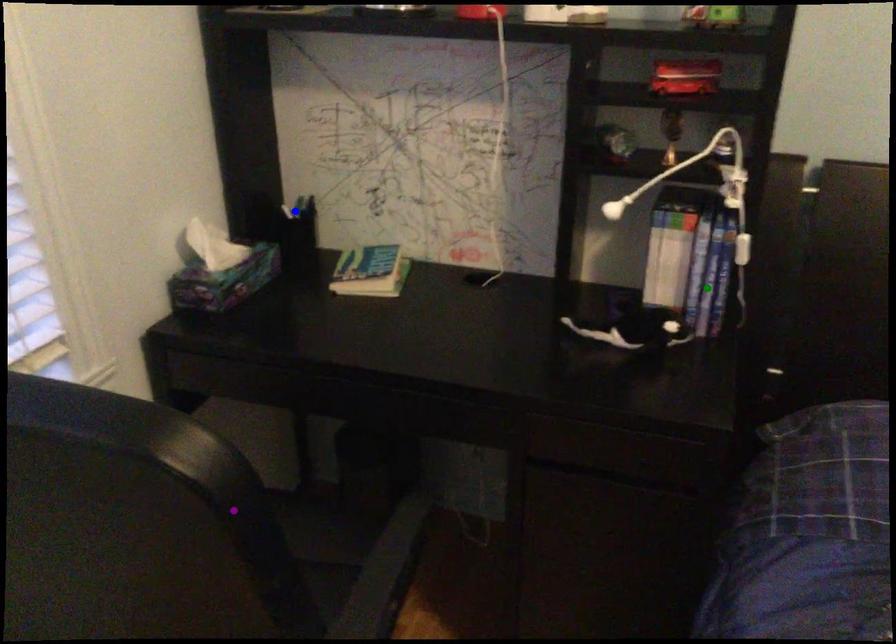
Order these from farthest to nearest:
blue point
green point
purple point

1. blue point
2. green point
3. purple point